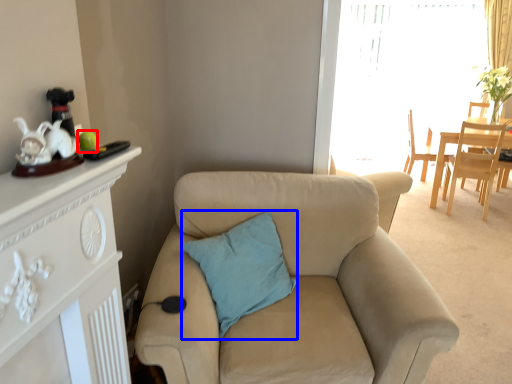
Question: Which point is further to the camera, teal (highlighted by a red box) or pillow (highlighted by a blue box)?

Choices:
 (A) teal
 (B) pillow

Answer: (B)